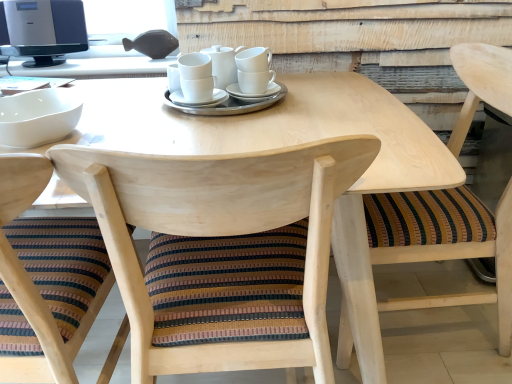
What are the coordinates of `free space underneath satin black monitor at upper left (from a real-world perspective)` in the screenshot? It's located at (40, 64).